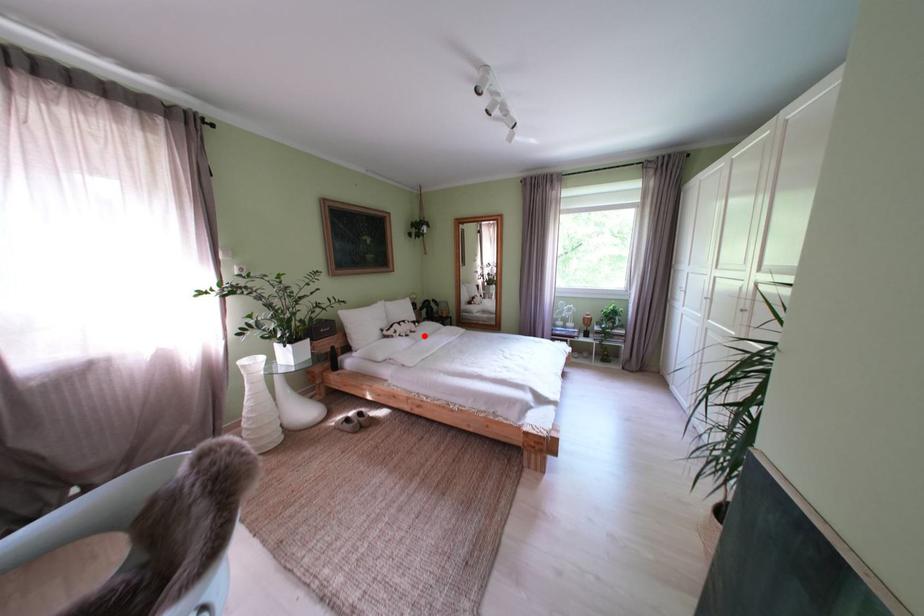
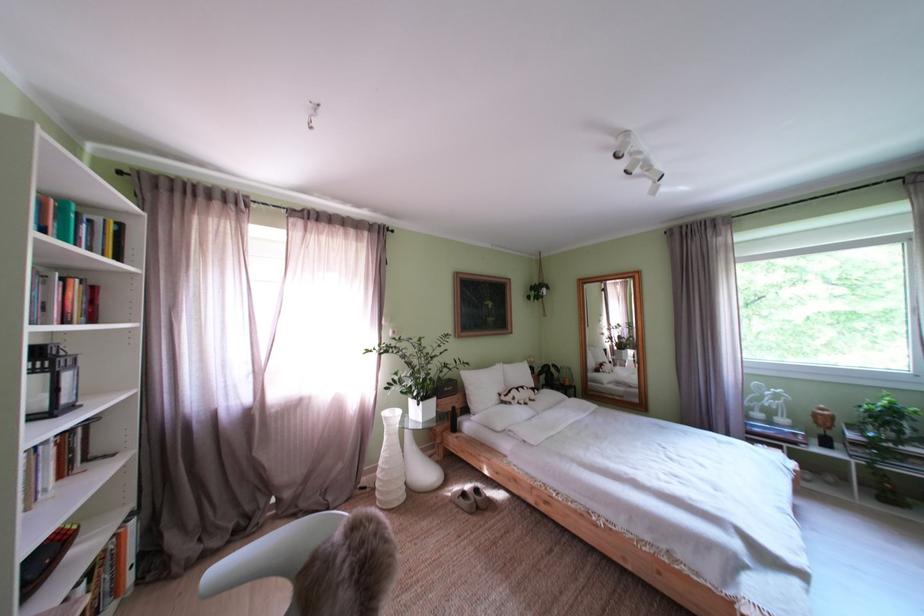
Question: A red point is marked in image1. In image2, is the corresponding 3D point closer to the camera or farther? Reply with the corresponding letter.

Choices:
 (A) The corresponding 3D point is closer.
 (B) The corresponding 3D point is farther.

Answer: (B)